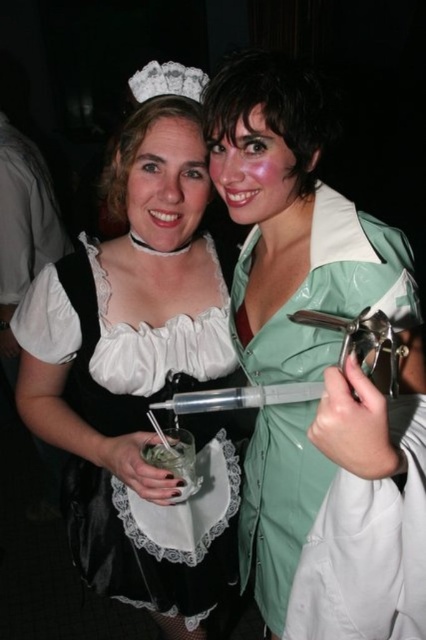
Question: Which object appears closest to the camera in this image?

Choices:
 (A) white lace dress at center
 (B) green shiny syringe at center

Answer: (B)

Question: Can you confirm if white lace dress at center is positioned to the right of green shiny syringe at center?

Choices:
 (A) yes
 (B) no

Answer: (B)

Question: Which of the following is the farthest from the observer?

Choices:
 (A) (365, 236)
 (B) (147, 524)

Answer: (B)

Question: From the image, what is the correct spatial relationship of white lace dress at center in relation to green shiny syringe at center?

Choices:
 (A) above
 (B) below

Answer: (B)

Question: Which object is closer to the camera taking this photo?

Choices:
 (A) green shiny syringe at center
 (B) white lace dress at center

Answer: (A)

Question: Can you confirm if white lace dress at center is smaller than green shiny syringe at center?

Choices:
 (A) yes
 (B) no

Answer: (B)